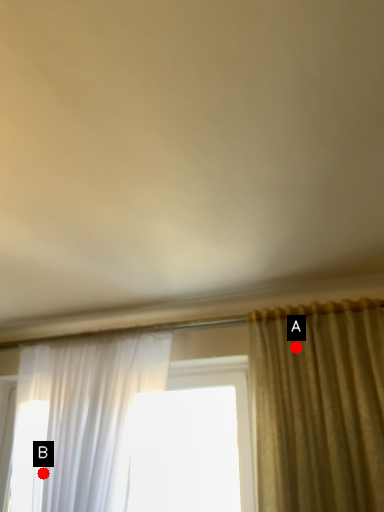
Question: Two points are circled on the image, labeled by A and B beside each circle. Among these points, which one is farthest from the camera?

Choices:
 (A) A is further
 (B) B is further

Answer: (B)